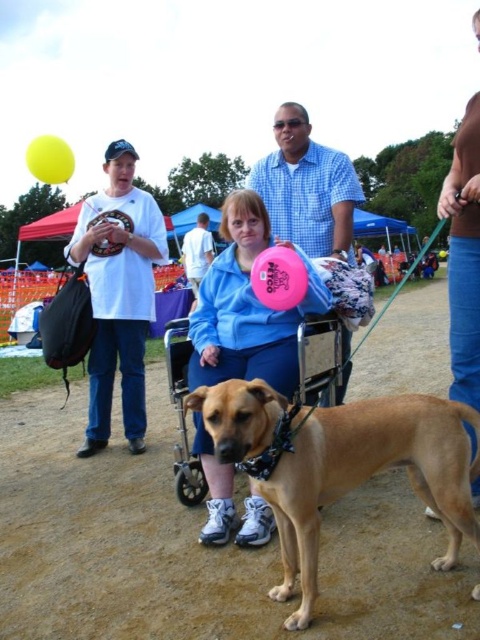
Question: Which point is farther to the camera?

Choices:
 (A) white matte t-shirt at left
 (B) blue fabric shirt at center
 (C) yellow rubber balloon at upper left

Answer: (B)

Question: Among these objects, which one is farthest from the camera?

Choices:
 (A) matte blue jacket at center
 (B) blue fabric shirt at center
 (C) blue checkered shirt at center

Answer: (B)

Question: Is matte blue jacket at center above blue fleece jacket at center?

Choices:
 (A) yes
 (B) no

Answer: (B)

Question: Which of the following is the closest to the observer?

Choices:
 (A) white matte t-shirt at left
 (B) brown leather dog at center

Answer: (B)

Question: Does blue checkered shirt at center come in front of blue fabric shirt at center?

Choices:
 (A) yes
 (B) no

Answer: (A)

Question: Does matte blue jacket at center have a lesser width compared to yellow rubber balloon at upper left?

Choices:
 (A) no
 (B) yes

Answer: (B)